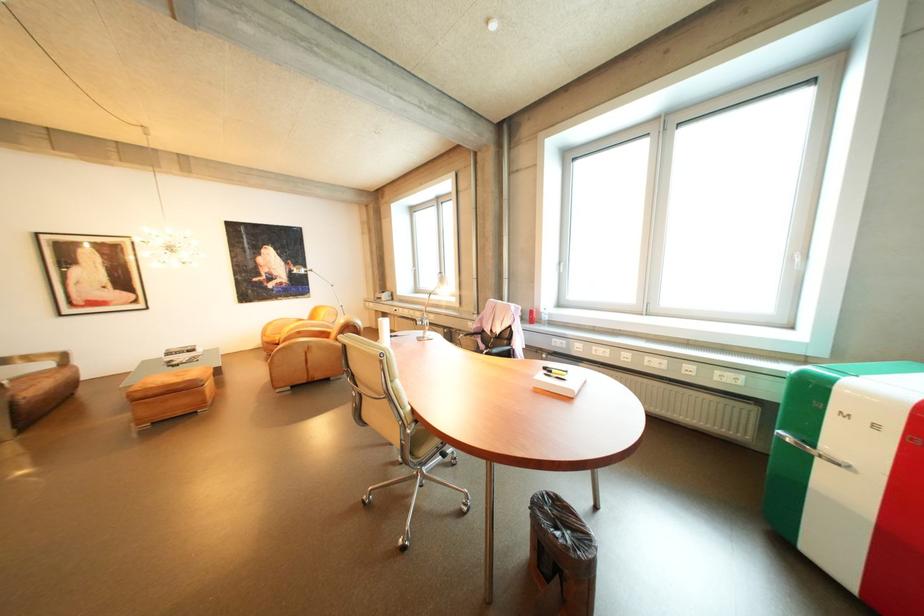
You are a GUI agent. You are given a task and a screenshot of the screen. Output one action in this format:
    pyautogui.click(x=<x>, y=<y>)
    Task: Click on the red plastic bottle
    
    Given the screenshot: What is the action you would take?
    pyautogui.click(x=531, y=315)